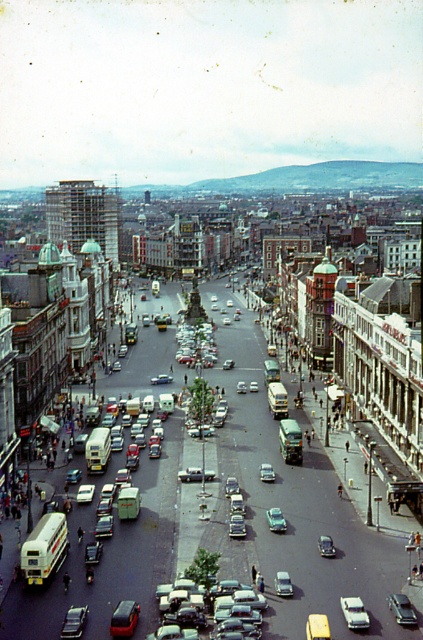
Question: Which is nearer to the metallic silver car at center?

Choices:
 (A) metallic silver bus at center
 (B) silver metallic sedan at center

Answer: (B)

Question: Which point is farther from the camera taking this photo?

Choices:
 (A) (x=66, y=598)
 (B) (x=159, y=602)

Answer: (A)

Question: Does metallic silver bus at center have a smaller size compared to silver metallic sedan at center?

Choices:
 (A) yes
 (B) no

Answer: (B)

Question: Which object is positioned farthest from the silver metallic sedan at center?

Choices:
 (A) metallic silver bus at center
 (B) metallic silver car at center

Answer: (A)

Question: Observing the image, what is the correct spatial positioning of metallic silver bus at center in reference to metallic silver car at center?

Choices:
 (A) below
 (B) above

Answer: (B)

Question: Is metallic silver bus at center to the left of silver metallic sedan at center from the viewer's perspective?

Choices:
 (A) yes
 (B) no

Answer: (A)